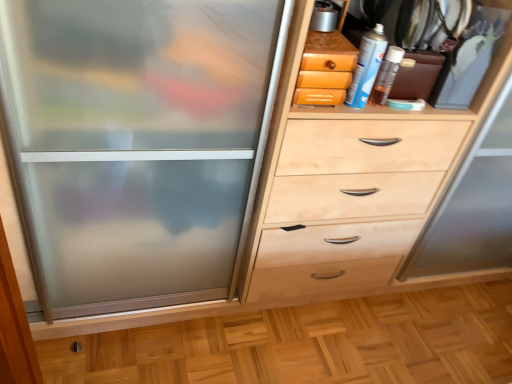
You are a GUI agent. You are given a task and a screenshot of the screen. Output one action in this format:
    pyautogui.click(x=<x>, y=<y>)
    Task: Click on the natural wood floor at lower center
    The height and width of the screenshot is (384, 512).
    Given the screenshot: What is the action you would take?
    pyautogui.click(x=309, y=343)

In order to face natural wood floor at lower center, should I rotate leftwards or rightwards?

You should look right and rotate roughly 14.998 degrees.

Image resolution: width=512 pixels, height=384 pixels. Describe the element at coordinates (309, 343) in the screenshot. I see `natural wood floor at lower center` at that location.

At what (x,y) coordinates should I click in order to perform the action: click on natural wood floor at lower center. Please return your answer as a coordinate pair (x, y). Image resolution: width=512 pixels, height=384 pixels. Looking at the image, I should click on (309, 343).